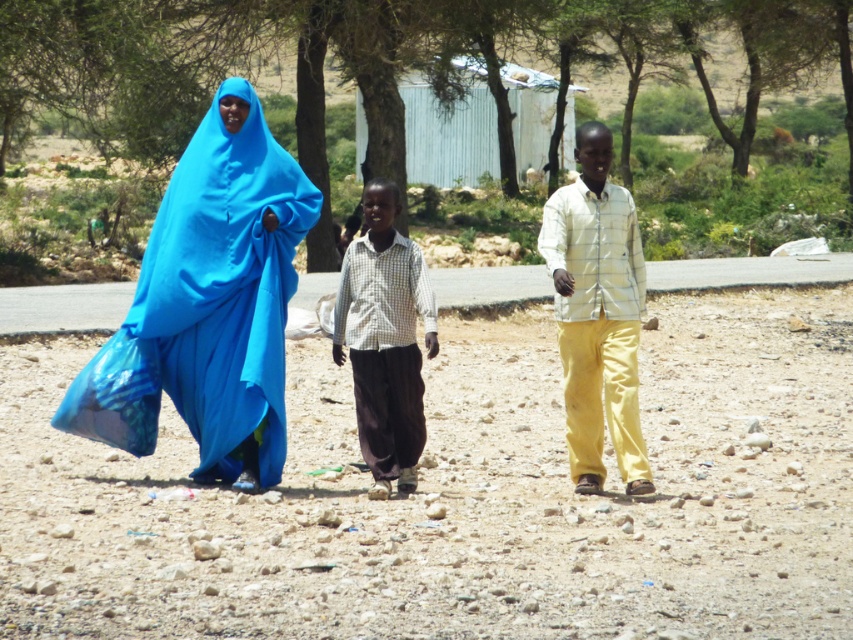
You are a photographer planning to take a photo of the dusty gravel at center and the white matte shirt at center. Which object should you focus on first if you want to capture both clearly in the same frame?

The dusty gravel at center is bigger than the white matte shirt at center, so you should focus on the dusty gravel at center first to ensure both are in focus.

You are standing at a point 8.73 meters away from the camera. If you want to walk towards the three people in the image, which direction should you move relative to the point labeled as point [595,326]?

The point labeled as point [595,326] is located 8.73 meters away from the camera. Since you are already at that point, you would need to move towards the three people who are further along the dirt path in the rural setting depicted in the scene.

You are standing on the path and want to pick up the white matte shirt at center. Can you reach it without stepping on the dusty gravel at center?

The dusty gravel at center is closer to the viewer than the white matte shirt at center, so you would need to step on the dusty gravel at center to reach the white matte shirt at center.